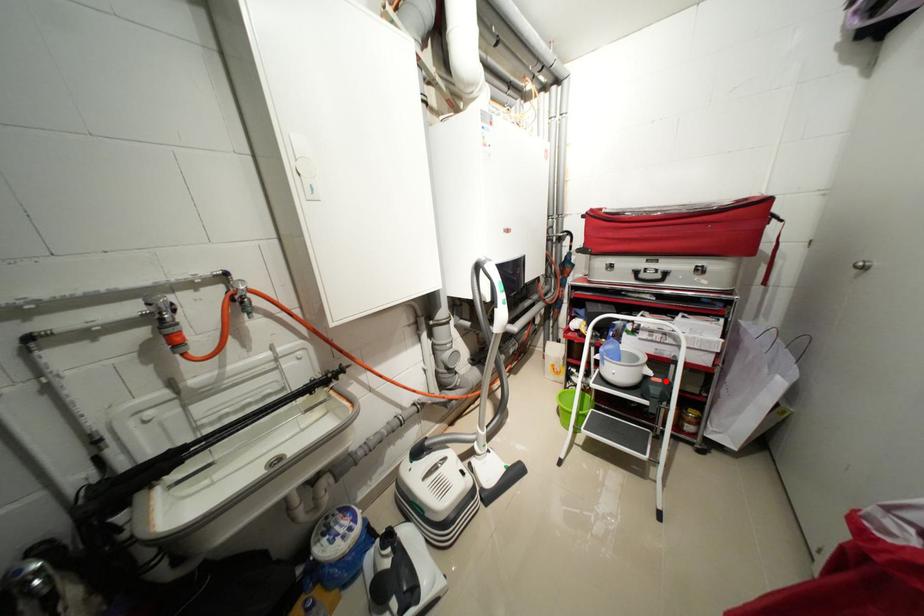
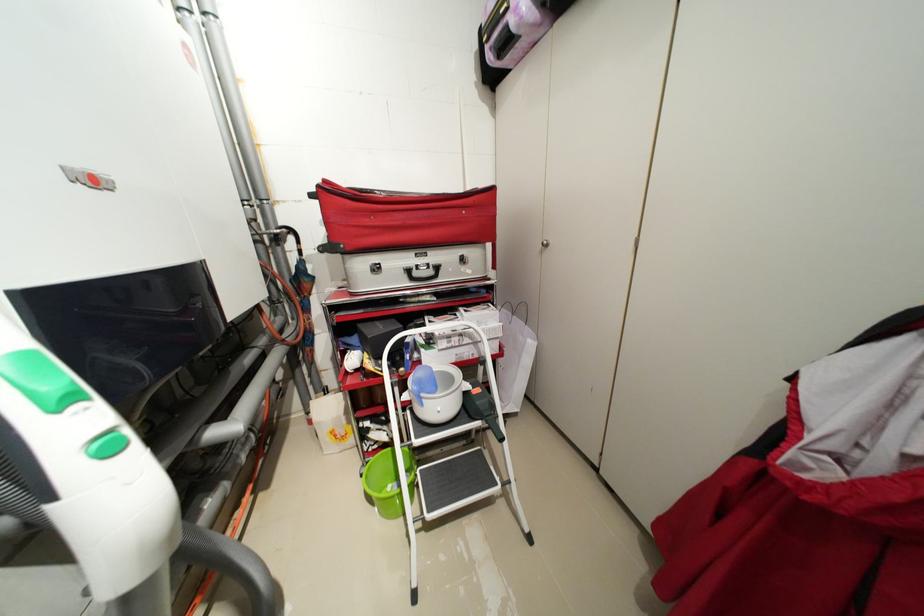
In the second image, find the point that corresponds to the highlighted location in the first image.

(484, 391)